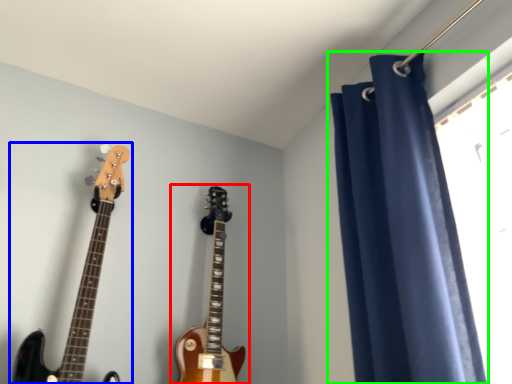
Question: Estimate the real-world distances between objects in this image. Which object is farther from guitar (highlighted by a red box), guitar (highlighted by a blue box) or curtain (highlighted by a green box)?

Choices:
 (A) guitar
 (B) curtain

Answer: (B)